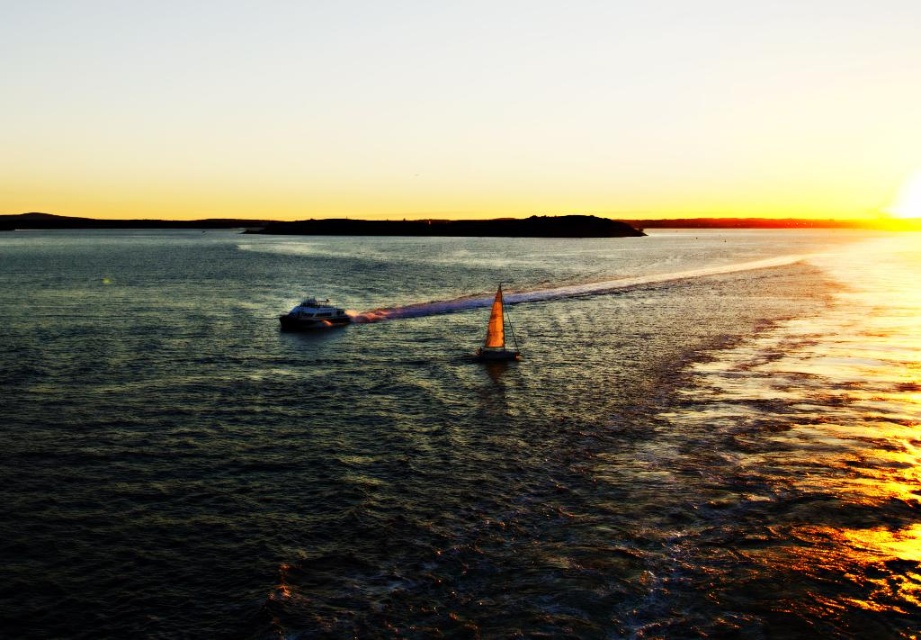
Question: Can you confirm if metallic silver boat at left is positioned below orange sail at center?

Choices:
 (A) no
 (B) yes

Answer: (A)

Question: Can you confirm if dark blue water at center is thinner than metallic silver boat at left?

Choices:
 (A) no
 (B) yes

Answer: (A)

Question: Which point is closer to the camera taking this photo?

Choices:
 (A) (288, 323)
 (B) (789, 252)
 (C) (487, 317)

Answer: (C)

Question: Which object is farther from the camera taking this photo?

Choices:
 (A) metallic silver boat at left
 (B) orange sail at center

Answer: (A)

Question: Does dark blue water at center have a smaller size compared to orange sail at center?

Choices:
 (A) yes
 (B) no

Answer: (B)

Question: Among these objects, which one is nearest to the camera?

Choices:
 (A) dark blue water at center
 (B) metallic silver boat at left
 (C) orange sail at center

Answer: (A)